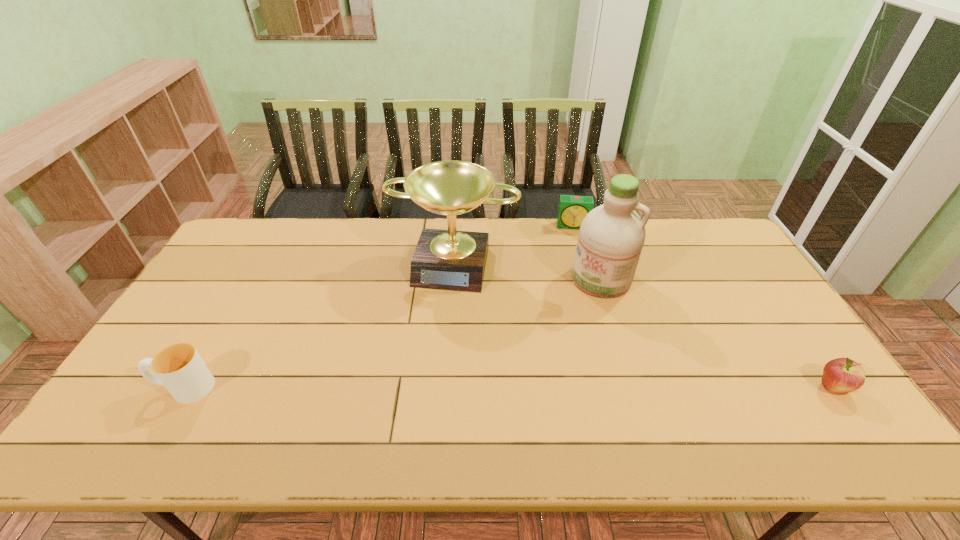
Locate an element on the screen. This screenshot has height=540, width=960. vacant area that lies between the leftmost object and the tallest object is located at coordinates (393, 333).

Identify the location of blank region between the farthest object and the award. (514, 245).

At what (x,y) coordinates should I click in order to perform the action: click on free space between the rightmost object and the cleansing agent. Please return your answer as a coordinate pair (x, y). The width and height of the screenshot is (960, 540). Looking at the image, I should click on (717, 333).

The image size is (960, 540). Identify the location of free space between the award and the tallest object. (528, 271).

At what (x,y) coordinates should I click in order to perform the action: click on empty space between the tallest object and the apple. Please return your answer as a coordinate pair (x, y). Image resolution: width=960 pixels, height=540 pixels. Looking at the image, I should click on (717, 333).

The image size is (960, 540). In order to click on blank region between the cup and the alarm clock in this screenshot , I will do `click(379, 307)`.

Locate an element on the screen. The width and height of the screenshot is (960, 540). vacant region between the leftmost object and the award is located at coordinates (320, 326).

Where is `vacant space in between the cleansing agent and the rightmost object`? This screenshot has width=960, height=540. vacant space in between the cleansing agent and the rightmost object is located at coordinates (717, 333).

Identify the location of free space between the farthest object and the rightmost object. This screenshot has height=540, width=960. (703, 307).

Where is `object that can be found as the third closest to the leftmost object`? The width and height of the screenshot is (960, 540). object that can be found as the third closest to the leftmost object is located at coordinates (572, 210).